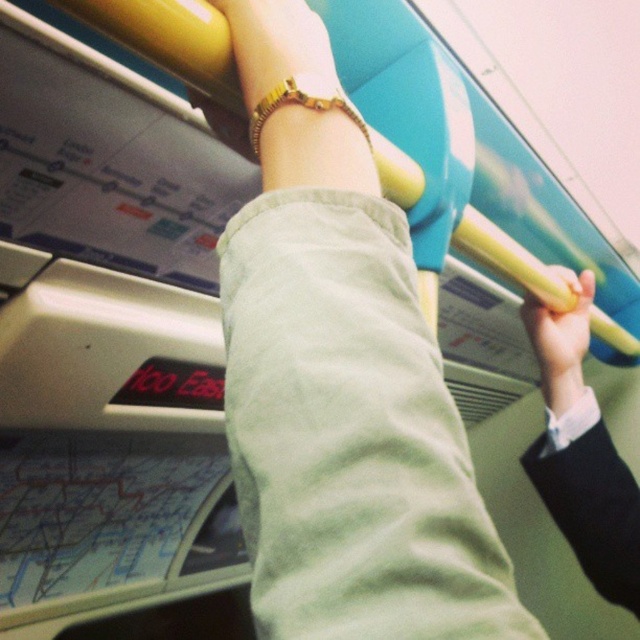
Question: Which object is the closest to the yellow rubber grip at upper right?

Choices:
 (A) light green cotton pants at center
 (B) gold textured bracelet at upper center

Answer: (B)

Question: Observing the image, what is the correct spatial positioning of light green cotton pants at center in reference to yellow rubber grip at upper right?

Choices:
 (A) left
 (B) right

Answer: (A)

Question: Which of these objects is positioned farthest from the gold textured bracelet at upper center?

Choices:
 (A) yellow rubber grip at upper right
 (B) light green cotton pants at center

Answer: (A)

Question: Considering the relative positions of light green cotton pants at center and yellow rubber grip at upper right in the image provided, where is light green cotton pants at center located with respect to yellow rubber grip at upper right?

Choices:
 (A) right
 (B) left

Answer: (B)

Question: Is yellow rubber grip at upper right to the left of gold textured bracelet at upper center from the viewer's perspective?

Choices:
 (A) yes
 (B) no

Answer: (B)

Question: Which object is positioned closest to the gold textured bracelet at upper center?

Choices:
 (A) light green cotton pants at center
 (B) yellow rubber grip at upper right

Answer: (A)